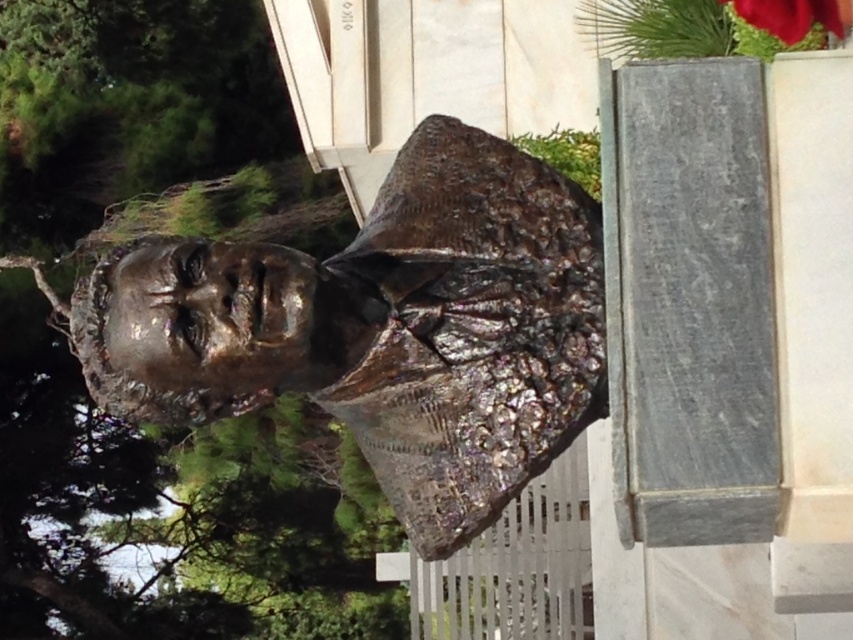
You are an artist planning to sketch the scene. You have a small sketchbook that can only accommodate details of objects up to 10 inches in size. The shiny bronze bust at center and the smooth red flower at upper right are both in your view. Which object should you focus on to ensure it fits within your sketchbook?

The shiny bronze bust at center is larger in size than the smooth red flower at upper right, so the smooth red flower at upper right is more likely to fit within the 10 inch limit of your sketchbook.

You are an artist planning to sketch this scene. You want to ensure the proportions between the shiny bronze bust at center and the smooth red flower at upper right are accurate. Which object should you draw larger in your sketch?

The shiny bronze bust at center should be drawn larger than the smooth red flower at upper right because it is much taller as stated in the description.